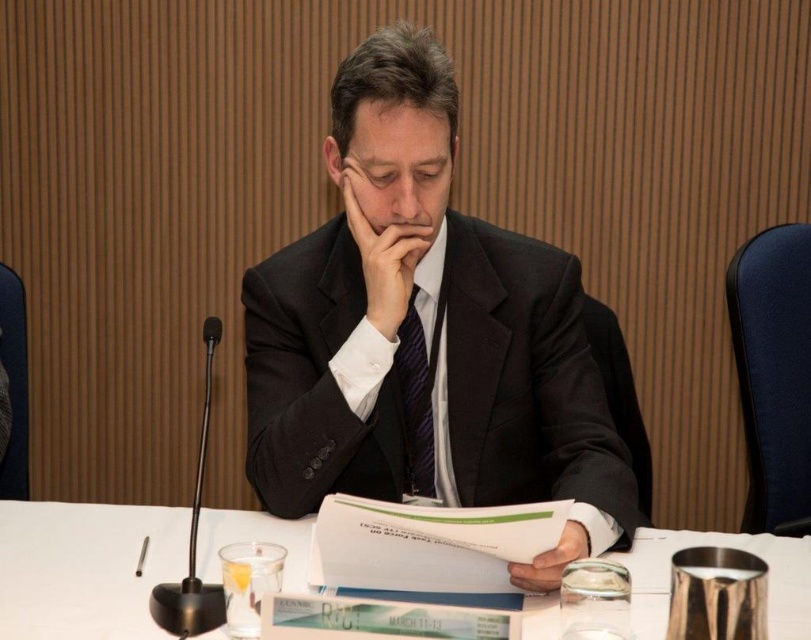
You are an event organizer who needs to ensure that the matte black suit at center does not cover the white matte paper at center during the event setup. Based on the current arrangement, is the suit currently obstructing the paper?

The matte black suit at center is positioned over white matte paper at center, so yes, the suit is currently obstructing the paper.

You are an event organizer who needs to ensure that all items on the table are visible to the camera. Given the current setup, will the matte black suit at center block the view of the white matte paper at center?

The matte black suit at center is taller than the white matte paper at center, so it may block the view of the white matte paper at center if positioned directly in front of it.

You are an assistant at a conference. You need to place a name tag on the table so it is visible to attendees but not blocking the white paper at center or the matte black hand at center. Where should you place it?

The white paper at center is in front of the matte black hand at center, so placing the name tag behind the white paper at center or beside it would keep it visible without blocking either object.